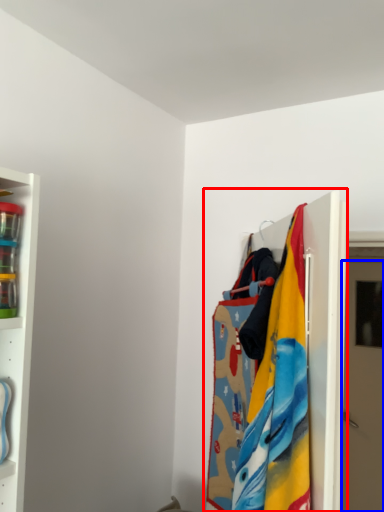
Question: Which point is further to the camera, closet (highlighted by a red box) or door (highlighted by a blue box)?

Choices:
 (A) closet
 (B) door

Answer: (B)